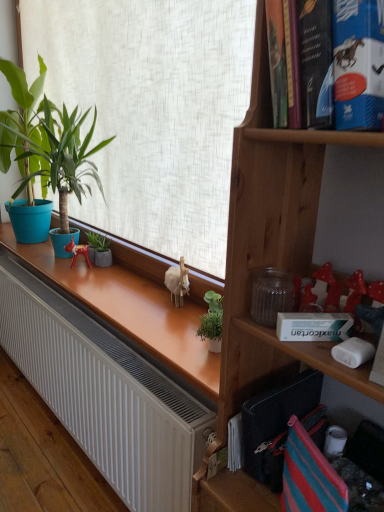
Image resolution: width=384 pixels, height=512 pixels. Describe the element at coordinates (46, 142) in the screenshot. I see `green matte plant at left, placed as the first houseplant when sorted from top to bottom` at that location.

Image resolution: width=384 pixels, height=512 pixels. Identify the location of green matte planter at center, which is the 1th houseplant in bottom-to-top order. (99, 249).

What do you see at coordinates (335, 63) in the screenshot? The width and height of the screenshot is (384, 512). I see `blue cardboard book at upper right` at bounding box center [335, 63].

This screenshot has height=512, width=384. I want to click on metallic red figurine at center, so click(x=78, y=252).

This screenshot has width=384, height=512. What do you see at coordinates (78, 252) in the screenshot?
I see `metallic red figurine at center` at bounding box center [78, 252].

This screenshot has width=384, height=512. In order to click on green matte plant at left, the second houseplant viewed from the back in this screenshot , I will do `click(46, 142)`.

From the image's perspective, is blue cardboard book at upper right located above or below green matte planter at center, which is counted as the 1th houseplant, starting from the back?

From the image's perspective, blue cardboard book at upper right appears above green matte planter at center, which is counted as the 1th houseplant, starting from the back.

Considering the sizes of objects blue cardboard book at upper right and green matte planter at center, the 2th houseplant when ordered from top to bottom, in the image provided, who is wider, blue cardboard book at upper right or green matte planter at center, the 2th houseplant when ordered from top to bottom,?

blue cardboard book at upper right is wider.

In terms of width, does green matte planter at center, the 2th houseplant when ordered from top to bottom, look wider or thinner when compared to green matte plant at left, which ranks as the second houseplant in bottom-to-top order?

In the image, green matte planter at center, the 2th houseplant when ordered from top to bottom, appears to be more narrow than green matte plant at left, which ranks as the second houseplant in bottom-to-top order.

Considering the relative sizes of green matte planter at center, the 2th houseplant when ordered from top to bottom, and green matte plant at left, positioned as the first houseplant in front-to-back order, in the image provided, is green matte planter at center, the 2th houseplant when ordered from top to bottom, shorter than green matte plant at left, positioned as the first houseplant in front-to-back order,?

Yes.

Considering the points (101, 260) and (35, 114), which point is behind, point (101, 260) or point (35, 114)?

The point (35, 114) is more distant.

At what (x,y) coordinates should I click in order to perform the action: click on houseplant that appears below the green matte plant at left, placed as the first houseplant when sorted from top to bottom (from the image's perspective). Please return your answer as a coordinate pair (x, y). Looking at the image, I should click on click(x=99, y=249).

Are green matte plant at left, positioned as the first houseplant in front-to-back order, and green matte planter at center, which is the 1th houseplant in bottom-to-top order, making contact?

No, green matte plant at left, positioned as the first houseplant in front-to-back order, is not next to green matte planter at center, which is the 1th houseplant in bottom-to-top order.

From a real-world perspective, is green matte plant at left, which ranks as the second houseplant in bottom-to-top order, physically above green matte planter at center, the 2th houseplant when ordered from top to bottom?

Yes, from a real-world perspective, green matte plant at left, which ranks as the second houseplant in bottom-to-top order, is above green matte planter at center, the 2th houseplant when ordered from top to bottom.

Is green matte plant at left, positioned as the first houseplant in front-to-back order, aimed at green matte planter at center, the 2th houseplant when ordered from top to bottom?

No, green matte plant at left, positioned as the first houseplant in front-to-back order, is not aimed at green matte planter at center, the 2th houseplant when ordered from top to bottom.

Considering the sizes of objects metallic red figurine at center and green matte planter at center, which is the 2th houseplant in front-to-back order, in the image provided, who is wider, metallic red figurine at center or green matte planter at center, which is the 2th houseplant in front-to-back order,?

metallic red figurine at center.

Consider the image. Does metallic red figurine at center lie in front of green matte planter at center, which is counted as the 1th houseplant, starting from the back?

Yes, metallic red figurine at center is closer to the viewer.

How far apart are metallic red figurine at center and green matte planter at center, which is counted as the 1th houseplant, starting from the back?

metallic red figurine at center is 2.20 inches from green matte planter at center, which is counted as the 1th houseplant, starting from the back.

Consider the image. Can you confirm if metallic red figurine at center is positioned to the right of green matte planter at center, which is the 1th houseplant in bottom-to-top order?

No, metallic red figurine at center is not to the right of green matte planter at center, which is the 1th houseplant in bottom-to-top order.

How many degrees apart are the facing directions of metallic red figurine at center and green matte plant at left, which ranks as the second houseplant in bottom-to-top order?

They differ by 27.7 degrees in their facing directions.

Where is `houseplant that is in front of the metallic red figurine at center`? houseplant that is in front of the metallic red figurine at center is located at coordinates [x=46, y=142].

From a real-world perspective, is metallic red figurine at center positioned over green matte plant at left, placed as the first houseplant when sorted from top to bottom, based on gravity?

No.

Based on the photo, can you confirm if metallic red figurine at center is taller than green matte plant at left, which ranks as the second houseplant in bottom-to-top order?

Incorrect, the height of metallic red figurine at center is not larger of that of green matte plant at left, which ranks as the second houseplant in bottom-to-top order.

Consider the image. Which is behind, white matte radiator at lower left or blue cardboard book at upper right?

white matte radiator at lower left.

Is white matte radiator at lower left inside or outside of blue cardboard book at upper right?

white matte radiator at lower left is not enclosed by blue cardboard book at upper right.

Which of these two, white matte radiator at lower left or blue cardboard book at upper right, is thinner?

With smaller width is blue cardboard book at upper right.

Consider the image. From a real-world perspective, which is physically above, white matte radiator at lower left or blue cardboard book at upper right?

blue cardboard book at upper right is physically above.

From a real-world perspective, between white matte radiator at lower left and metallic red figurine at center, who is vertically higher?

From a 3D spatial view, metallic red figurine at center is above.

Does point (89, 454) appear closer or farther from the camera than point (78, 252)?

Point (89, 454) appears to be closer to the viewer than point (78, 252).

Considering the relative positions of white matte radiator at lower left and metallic red figurine at center in the image provided, is white matte radiator at lower left to the left of metallic red figurine at center from the viewer's perspective?

Yes.

Could you tell me if white matte radiator at lower left is facing metallic red figurine at center?

No, white matte radiator at lower left is not aimed at metallic red figurine at center.

The height and width of the screenshot is (512, 384). What are the coordinates of `the 2nd houseplant behind when counting from the blue cardboard book at upper right` in the screenshot? It's located at (99, 249).

The height and width of the screenshot is (512, 384). I want to click on houseplant in front of the green matte planter at center, which is the 1th houseplant in bottom-to-top order, so click(46, 142).

In the scene shown: Estimate the real-world distances between objects in this image. Which object is closer to green matte planter at center, which is counted as the 1th houseplant, starting from the back, blue cardboard book at upper right or white matte radiator at lower left?

white matte radiator at lower left lies closer to green matte planter at center, which is counted as the 1th houseplant, starting from the back, than the other object.

When comparing their distances from green matte planter at center, which is the 1th houseplant in bottom-to-top order, does green matte plant at left, which ranks as the second houseplant in bottom-to-top order, or white matte radiator at lower left seem closer?

green matte plant at left, which ranks as the second houseplant in bottom-to-top order, lies closer to green matte planter at center, which is the 1th houseplant in bottom-to-top order, than the other object.

Considering their positions, is metallic red figurine at center positioned further to green matte planter at center, which is the 2th houseplant in front-to-back order, than blue cardboard book at upper right?

Based on the image, blue cardboard book at upper right appears to be further to green matte planter at center, which is the 2th houseplant in front-to-back order.

Looking at the image, which one is located further to white matte radiator at lower left, green matte planter at center, which is the 2th houseplant in front-to-back order, or metallic red figurine at center?

metallic red figurine at center lies further to white matte radiator at lower left than the other object.

Considering their positions, is green matte plant at left, which ranks as the second houseplant in bottom-to-top order, positioned closer to metallic red figurine at center than green matte planter at center, which is the 2th houseplant in front-to-back order?

green matte planter at center, which is the 2th houseplant in front-to-back order, is closer to metallic red figurine at center.

Considering their positions, is green matte plant at left, placed as the first houseplant when sorted from top to bottom, positioned closer to blue cardboard book at upper right than green matte planter at center, which is the 1th houseplant in bottom-to-top order?

green matte planter at center, which is the 1th houseplant in bottom-to-top order, lies closer to blue cardboard book at upper right than the other object.

Estimate the real-world distances between objects in this image. Which object is further from green matte planter at center, which is the 1th houseplant in bottom-to-top order, metallic red figurine at center or white matte radiator at lower left?

white matte radiator at lower left lies further to green matte planter at center, which is the 1th houseplant in bottom-to-top order, than the other object.

Which object lies further to the anchor point blue cardboard book at upper right, white matte radiator at lower left or green matte planter at center, which is the 2th houseplant in front-to-back order?

Based on the image, green matte planter at center, which is the 2th houseplant in front-to-back order, appears to be further to blue cardboard book at upper right.

Identify the location of toy positioned between blue cardboard book at upper right and green matte planter at center, which is counted as the 1th houseplant, starting from the back, from near to far. This screenshot has height=512, width=384. (78, 252).

Where is `houseplant between blue cardboard book at upper right and green matte planter at center, the 2th houseplant when ordered from top to bottom, from front to back`? Image resolution: width=384 pixels, height=512 pixels. houseplant between blue cardboard book at upper right and green matte planter at center, the 2th houseplant when ordered from top to bottom, from front to back is located at coordinates (46, 142).

The image size is (384, 512). What are the coordinates of `radiator between blue cardboard book at upper right and metallic red figurine at center from front to back` in the screenshot? It's located at (104, 394).

Find the location of a particular element. This screenshot has width=384, height=512. toy positioned between green matte plant at left, the second houseplant viewed from the back, and green matte planter at center, which is the 2th houseplant in front-to-back order, from near to far is located at coordinates (78, 252).